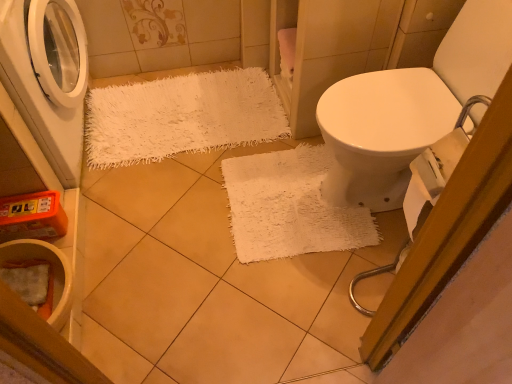
Question: Is white ceramic toilet bowl at lower left positioned far away from white matte washing machine at left?

Choices:
 (A) no
 (B) yes

Answer: (A)

Question: Is white ceramic toilet bowl at lower left wider than white matte washing machine at left?

Choices:
 (A) no
 (B) yes

Answer: (A)

Question: From the image's perspective, is white ceramic toilet bowl at lower left over white matte washing machine at left?

Choices:
 (A) yes
 (B) no

Answer: (B)

Question: From the image's perspective, is white ceramic toilet bowl at lower left beneath white matte washing machine at left?

Choices:
 (A) no
 (B) yes

Answer: (B)

Question: Is white ceramic toilet bowl at lower left at the left side of white matte washing machine at left?

Choices:
 (A) yes
 (B) no

Answer: (B)

Question: Does point (71, 281) appear closer or farther from the camera than point (278, 100)?

Choices:
 (A) farther
 (B) closer

Answer: (B)

Question: From the image's perspective, is white ceramic toilet bowl at lower left located above or below white shaggy rug at upper left?

Choices:
 (A) below
 (B) above

Answer: (A)

Question: From a real-world perspective, is white ceramic toilet bowl at lower left above or below white shaggy rug at upper left?

Choices:
 (A) above
 (B) below

Answer: (A)

Question: Looking at the image, does white ceramic toilet bowl at lower left seem bigger or smaller compared to white shaggy rug at upper left?

Choices:
 (A) small
 (B) big

Answer: (A)

Question: In the image, is white shaggy rug at upper left positioned in front of or behind white matte washing machine at left?

Choices:
 (A) behind
 (B) front

Answer: (A)

Question: Is white shaggy rug at upper left bigger or smaller than white matte washing machine at left?

Choices:
 (A) small
 (B) big

Answer: (A)

Question: Is white shaggy rug at upper left wider or thinner than white matte washing machine at left?

Choices:
 (A) thin
 (B) wide

Answer: (B)

Question: From the image's perspective, is white shaggy rug at upper left positioned above or below white matte washing machine at left?

Choices:
 (A) below
 (B) above

Answer: (A)

Question: From the image's perspective, relative to white ceramic toilet bowl at lower left, is white matte washing machine at left above or below?

Choices:
 (A) above
 (B) below

Answer: (A)

Question: In terms of width, does white matte washing machine at left look wider or thinner when compared to white ceramic toilet bowl at lower left?

Choices:
 (A) wide
 (B) thin

Answer: (A)